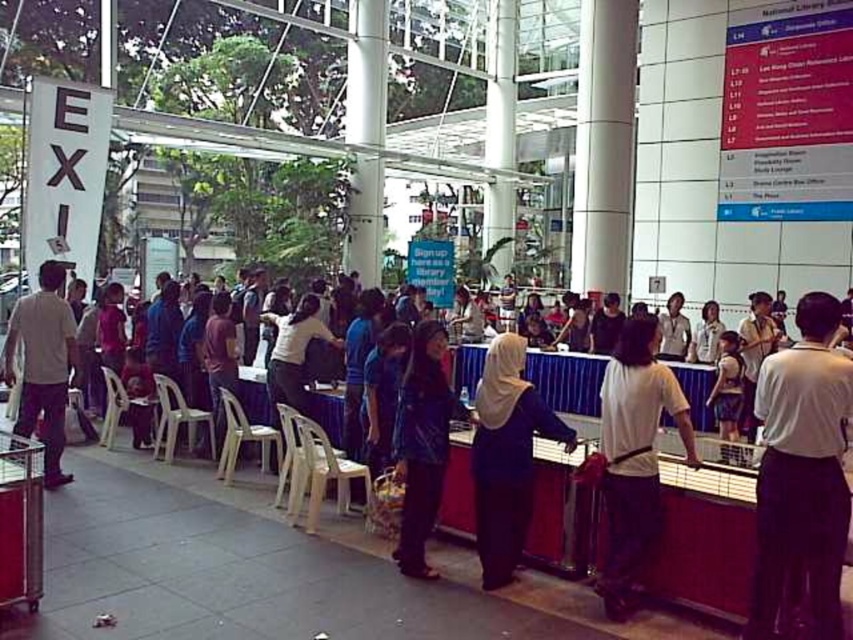
You are a person in a wheelchair with a 1.2 meter turning radius. You need to navigate between the white matte shirt at center and the dark blue leather jacket at center. Can you safely maneuver between them?

The white matte shirt at center and dark blue leather jacket at center are 1.16 meters apart from each other. Since your wheelchair requires a 1.2 meter turning radius, the space between them is slightly narrower than needed, so it might be tight but possible with caution.

You are a visitor at the service counter and need to address the staff member wearing the white matte shirt at left. Where should you look relative to the purple matte hijab at center?

The purple matte hijab at center is located below the white matte shirt at left, so you should look upward from the purple matte hijab at center to find the white matte shirt at left.

You are a visitor at the service counter and need to address the staff member wearing the white matte shirt at center. Which side of the dark blue leather jacket at center should you approach from?

The white matte shirt at center is to the right of the dark blue leather jacket at center, so you should approach from the right side of the dark blue leather jacket at center.